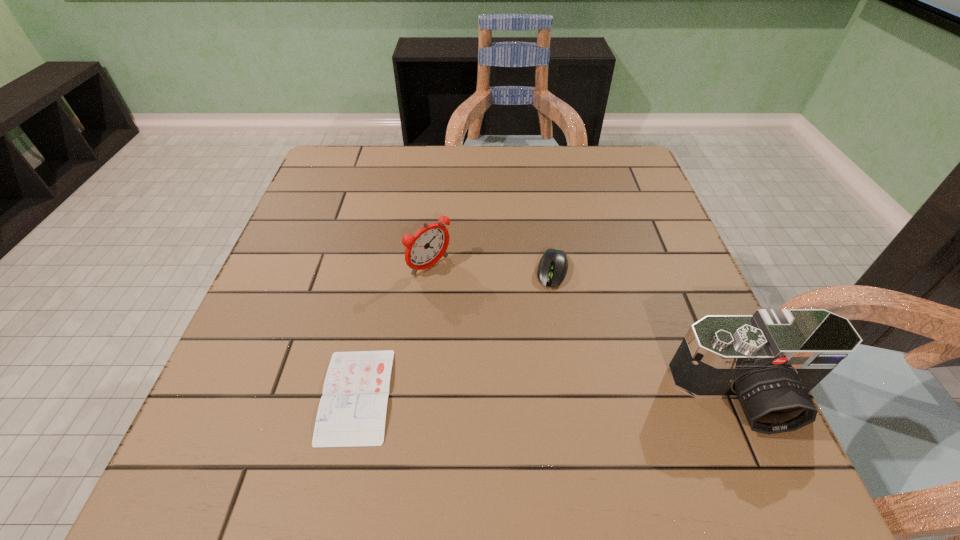
Locate an element on the screen. Image resolution: width=960 pixels, height=540 pixels. vacant space located 0.130m on the wheel side of the computer mouse is located at coordinates (540, 338).

This screenshot has width=960, height=540. I want to click on free space located on the wheel side of the computer mouse, so click(x=537, y=350).

Locate an element on the screen. This screenshot has width=960, height=540. vacant space located on the wheel side of the computer mouse is located at coordinates (528, 387).

I want to click on diary that is at the near edge, so click(x=352, y=411).

Locate an element on the screen. camera located at the near edge is located at coordinates (771, 360).

The width and height of the screenshot is (960, 540). Find the location of `object at the right edge`. object at the right edge is located at coordinates (771, 360).

Image resolution: width=960 pixels, height=540 pixels. I want to click on object that is at the near right corner, so click(x=771, y=360).

At what (x,y) coordinates should I click in order to perform the action: click on vacant space at the far edge of the desktop. Please return your answer as a coordinate pair (x, y). Looking at the image, I should click on (575, 175).

In order to click on vacant space at the near edge of the desktop in this screenshot , I will do `click(456, 382)`.

I want to click on free region at the left edge of the desktop, so click(x=320, y=222).